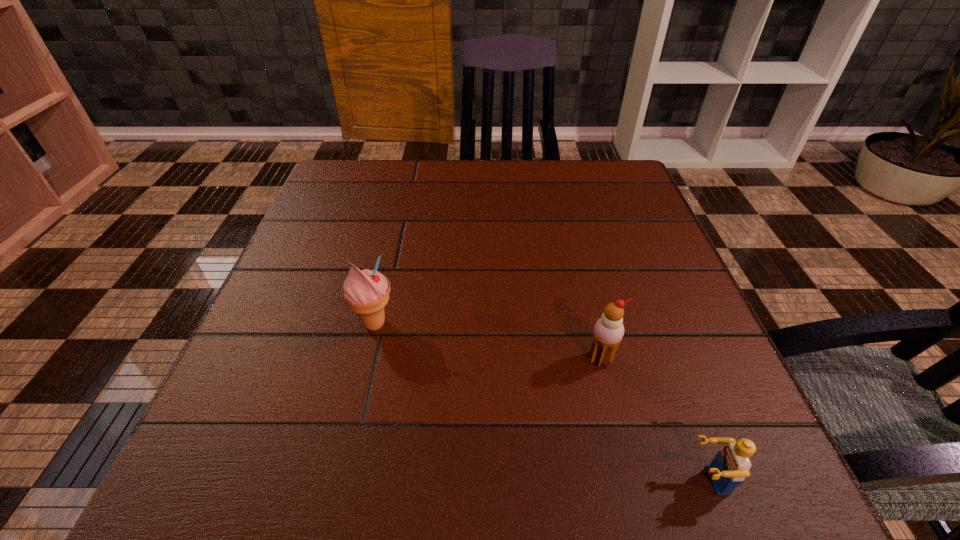
Image resolution: width=960 pixels, height=540 pixels. I want to click on the left icecream, so click(x=366, y=292).

Locate an element on the screen. The width and height of the screenshot is (960, 540). the farthest object is located at coordinates (366, 292).

Find the location of a particular element. This screenshot has width=960, height=540. the second nearest object is located at coordinates (608, 332).

At what (x,y) coordinates should I click in order to perform the action: click on the second object from right to left. Please return your answer as a coordinate pair (x, y). The height and width of the screenshot is (540, 960). Looking at the image, I should click on (608, 332).

Where is `Lego`? Lego is located at coordinates (731, 465).

The height and width of the screenshot is (540, 960). In order to click on the rightmost object in this screenshot , I will do `click(731, 465)`.

Where is `vacant space located on the back of the farther icecream`? This screenshot has width=960, height=540. vacant space located on the back of the farther icecream is located at coordinates (393, 246).

The width and height of the screenshot is (960, 540). Identify the location of vacant area located at the front with a straw on the second farthest object. (630, 478).

Locate an element on the screen. free location located on the face of the shortest object is located at coordinates (580, 480).

Identify the location of vacant area located on the face of the shortest object. This screenshot has width=960, height=540. (565, 480).